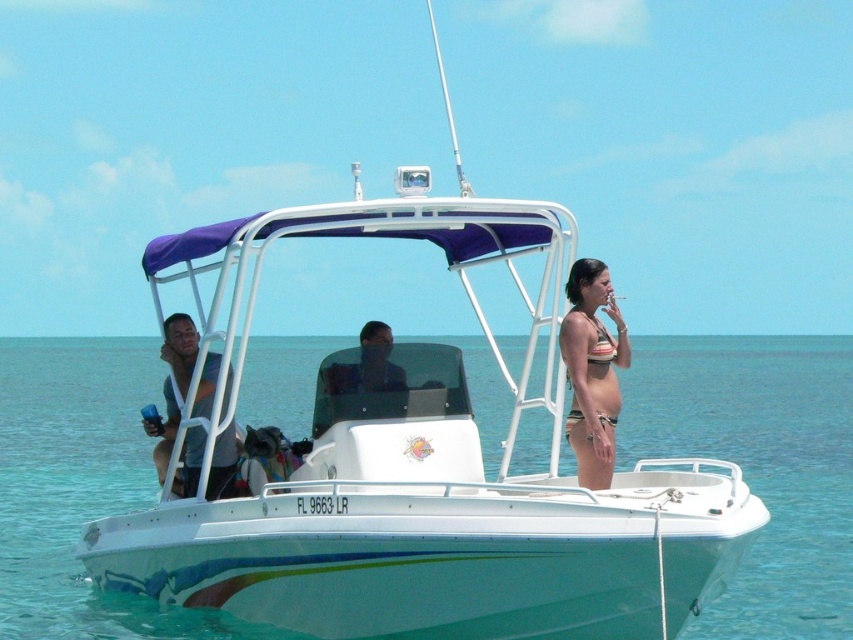
Who is more forward, (572, 314) or (170, 353)?

Point (572, 314) is more forward.

Is striped bikini at center shorter than light blue fabric shirt at center?

Incorrect, striped bikini at center's height does not fall short of light blue fabric shirt at center's.

I want to click on striped bikini at center, so point(592,371).

Can you confirm if clear blue water at boat center is smaller than light blue fabric shirt at center?

Actually, clear blue water at boat center might be larger than light blue fabric shirt at center.

Can you confirm if clear blue water at boat center is thinner than light blue fabric shirt at center?

In fact, clear blue water at boat center might be wider than light blue fabric shirt at center.

Measure the distance between clear blue water at boat center and camera.

The distance of clear blue water at boat center from camera is 34.10 feet.

At what (x,y) coordinates should I click in order to perform the action: click on clear blue water at boat center. Please return your answer as a coordinate pair (x, y). This screenshot has width=853, height=640. Looking at the image, I should click on (759, 467).

In the scene shown: Can you confirm if light blue fabric shirt at center is thinner than striped fabric bikini at right?

In fact, light blue fabric shirt at center might be wider than striped fabric bikini at right.

Who is shorter, light blue fabric shirt at center or striped fabric bikini at right?

light blue fabric shirt at center is shorter.

Is point (155, 456) farther from viewer compared to point (589, 317)?

Yes, point (155, 456) is behind point (589, 317).

This screenshot has height=640, width=853. What are the coordinates of `light blue fabric shirt at center` in the screenshot? It's located at pos(173,384).